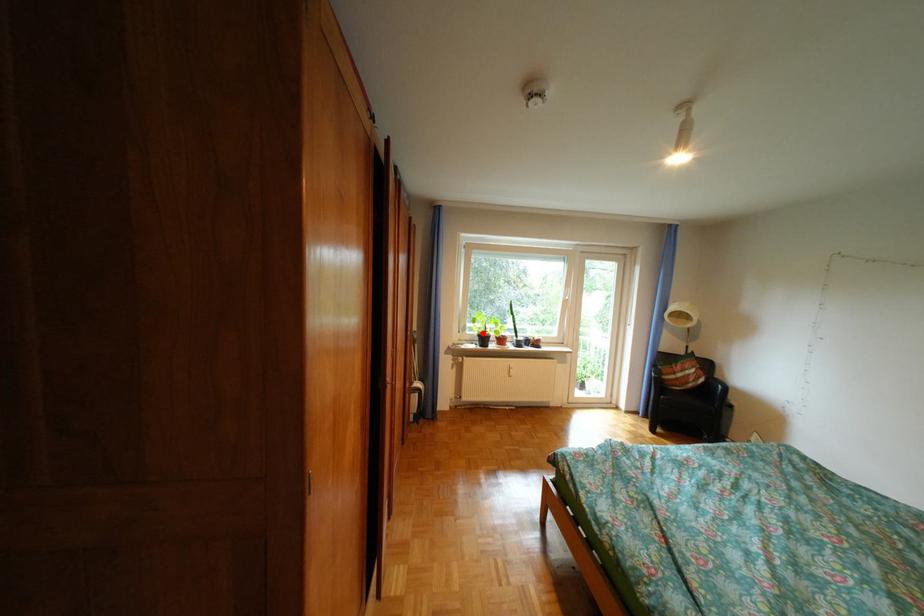
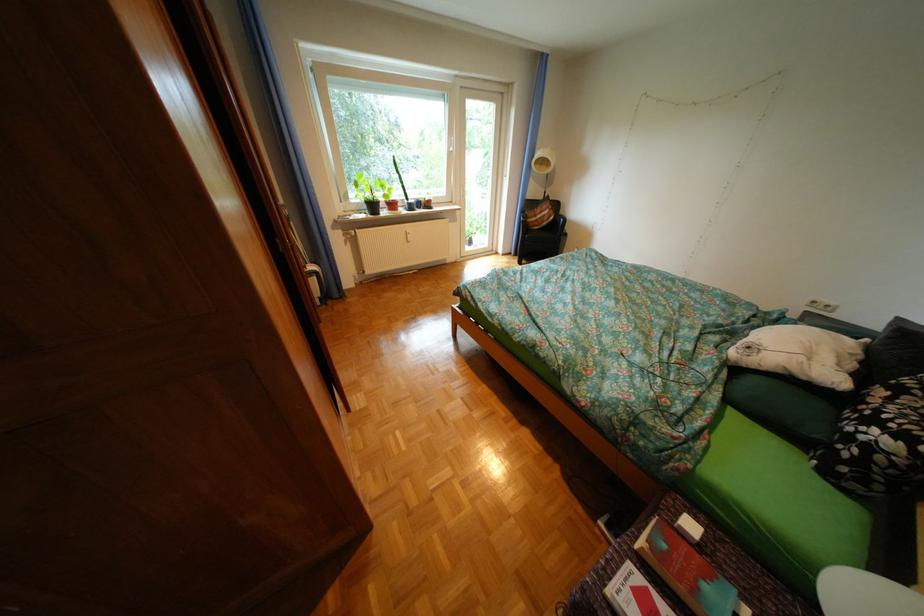
Question: A red point is marked in image1. In image2, is the corresponding 3D point closer to the camera or farther? Reply with the corresponding letter.

Choices:
 (A) The corresponding 3D point is closer.
 (B) The corresponding 3D point is farther.

Answer: (A)